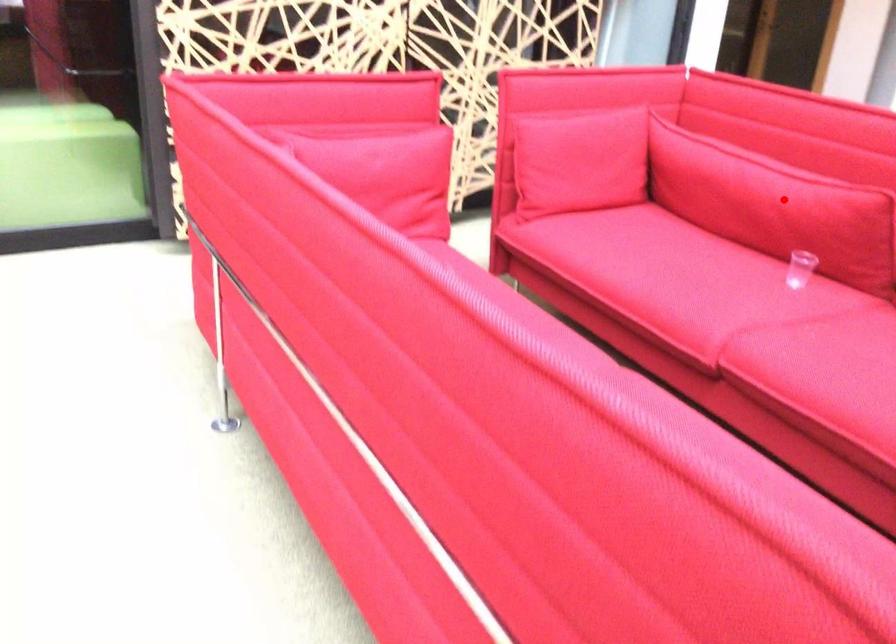
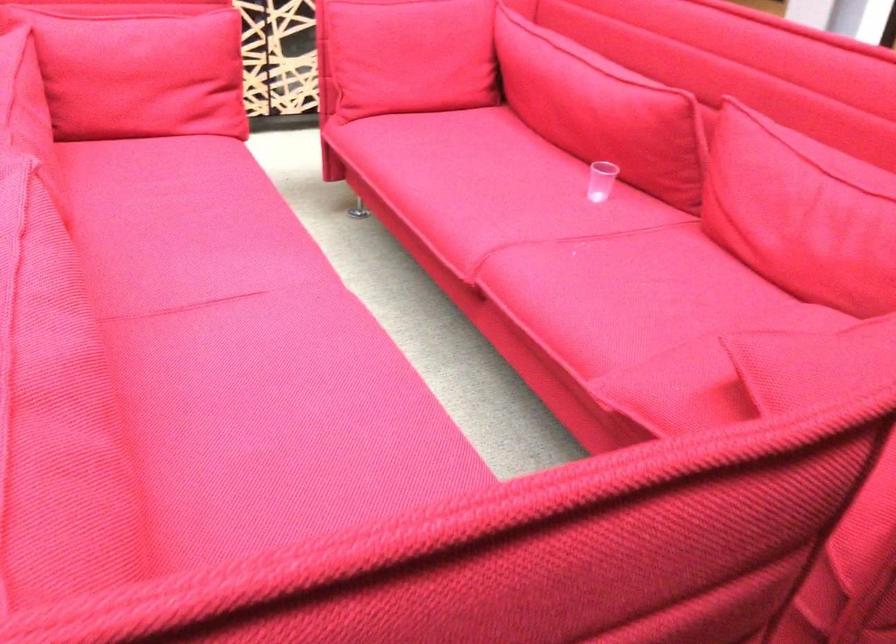
Locate, in the second image, the point that corresponds to the highlighted location in the first image.

(601, 109)